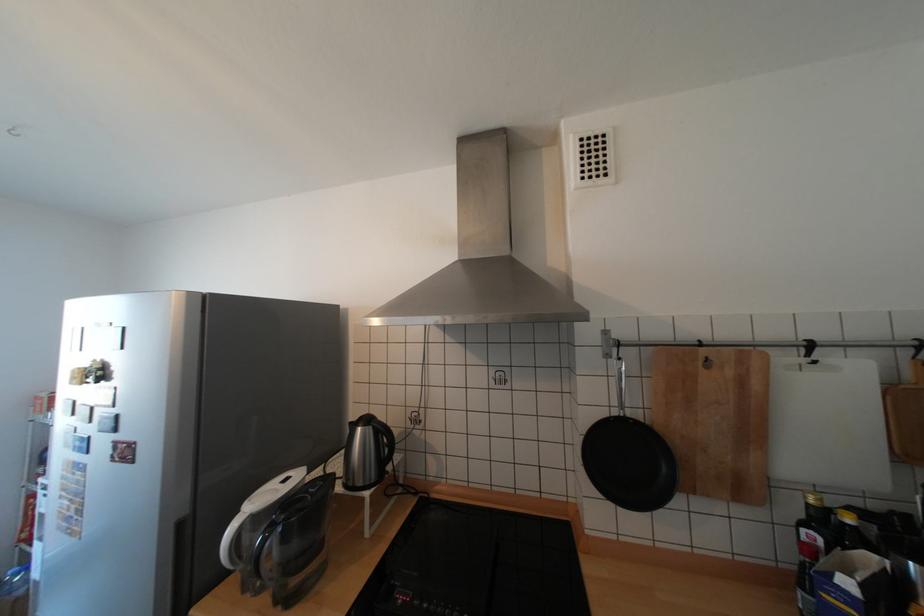
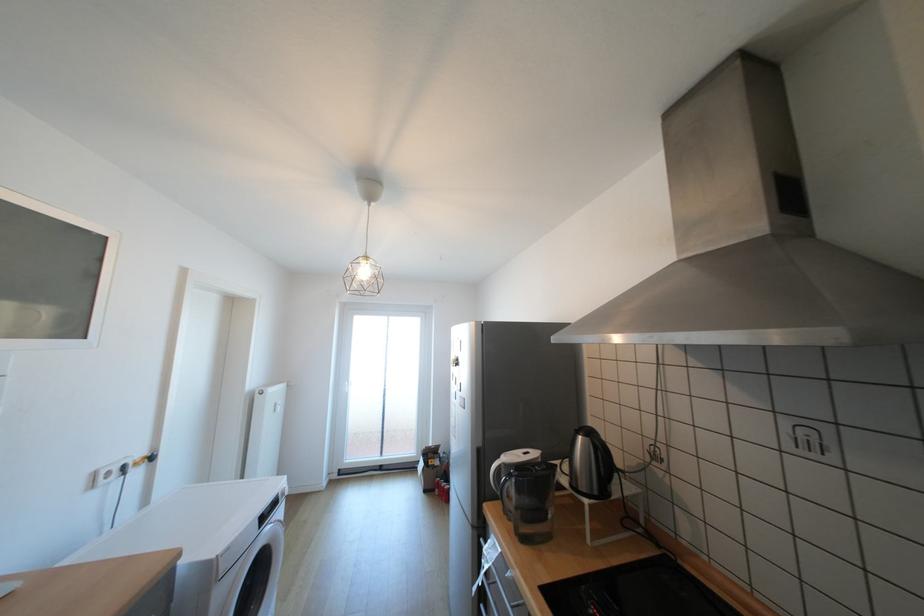
Question: The camera is either moving clockwise (left) or counter-clockwise (right) around the object. The first image is from the beginning of the video and the second image is from the end. Is the camera moving left or right when shooting the video?

Choices:
 (A) Left
 (B) Right

Answer: (B)